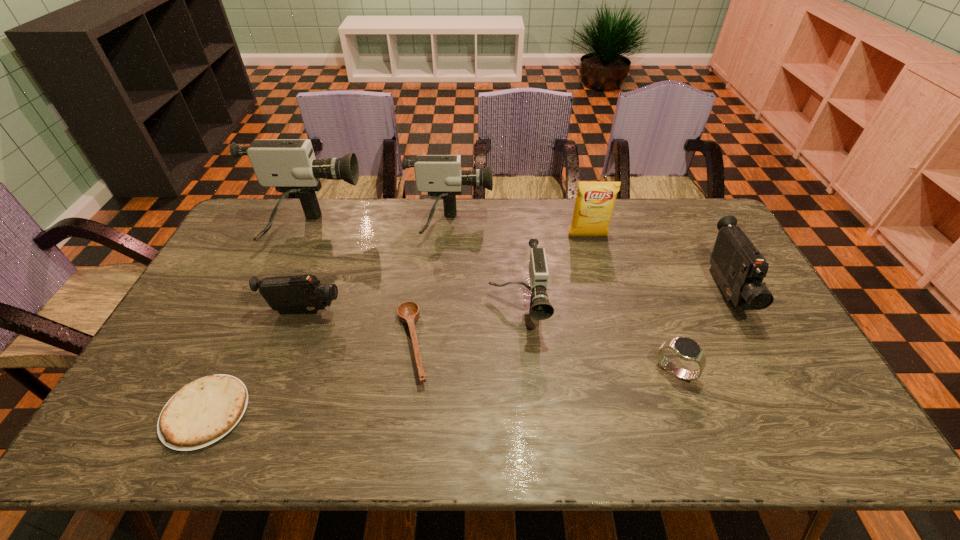
At what (x,y) coordinates should I click in order to perform the action: click on the tallest camcorder. Please return your answer as a coordinate pair (x, y). Looking at the image, I should click on (289, 165).

Find the location of a particular element. The width and height of the screenshot is (960, 540). the tallest object is located at coordinates (289, 165).

Where is `the fourth shortest camcorder`? the fourth shortest camcorder is located at coordinates (441, 176).

You are a GUI agent. You are given a task and a screenshot of the screen. Output one action in this format:
    pyautogui.click(x=<x>, y=<y>)
    Task: Click on the crisp (potato chip)
    This screenshot has width=960, height=540.
    Given the screenshot: What is the action you would take?
    pyautogui.click(x=595, y=201)

Locate an element on the screen. The width and height of the screenshot is (960, 540). the right black camcorder is located at coordinates (738, 267).

Image resolution: width=960 pixels, height=540 pixels. I want to click on the bigger black camcorder, so click(738, 267).

Locate an element on the screen. The height and width of the screenshot is (540, 960). the nearest white camcorder is located at coordinates (540, 309).

In order to click on the shortest camcorder in this screenshot , I will do `click(301, 293)`.

You are a GUI agent. You are given a task and a screenshot of the screen. Output one action in this format:
    pyautogui.click(x=<x>, y=<y>)
    Task: Click on the sixth tallest object
    The width and height of the screenshot is (960, 540).
    Given the screenshot: What is the action you would take?
    pyautogui.click(x=301, y=293)

At what (x,y) coordinates should I click in order to perform the action: click on blue watch. Please return your answer as a coordinate pair (x, y). Looking at the image, I should click on (685, 348).